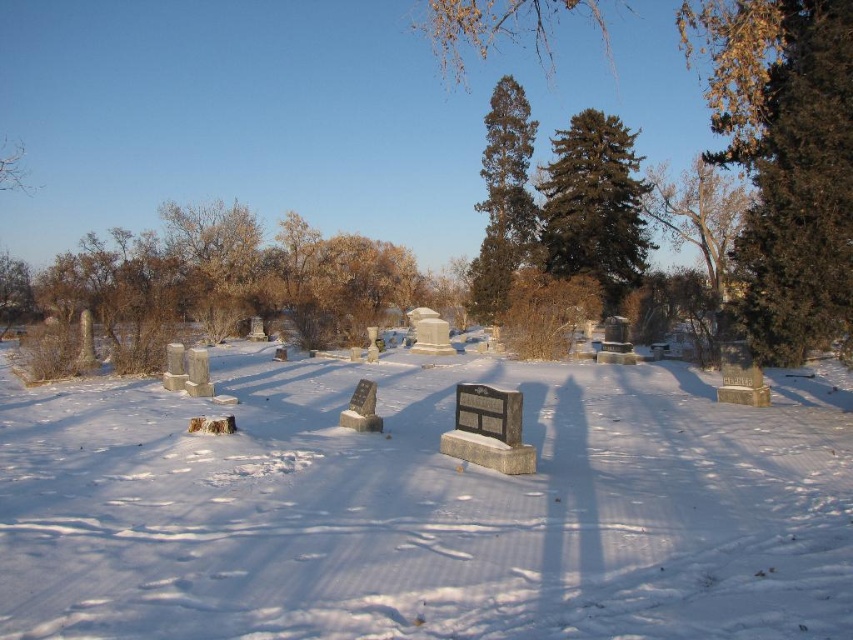
You are standing in the cemetery and want to reach the point marked at coordinates (801, 330). Given that you can walk 1.5 meters per second, how long will it take you to reach that point?

The distance between you and the point marked at coordinates (801, 330) is 11.17 meters. At a walking speed of 1.5 meters per second, it will take approximately 7.45 seconds to reach the point.

You are standing in the cemetery and notice the white powdery snow at center and the dark green coniferous tree at center. Which object occupies a larger area in the image?

The dark green coniferous tree at center occupies a larger area in the image than the white powdery snow at center.

You are planning to place a small decorative snowman on the white powdery snow at center. Considering the brown textured tree at upper left is casting a shadow over the snow, will the snowman be visible under the shadow?

The white powdery snow at center is thinner than brown textured tree at upper left, so the snowman may not be as visible under the shadow because the snow there is less thick and might not hold the snowman as well.